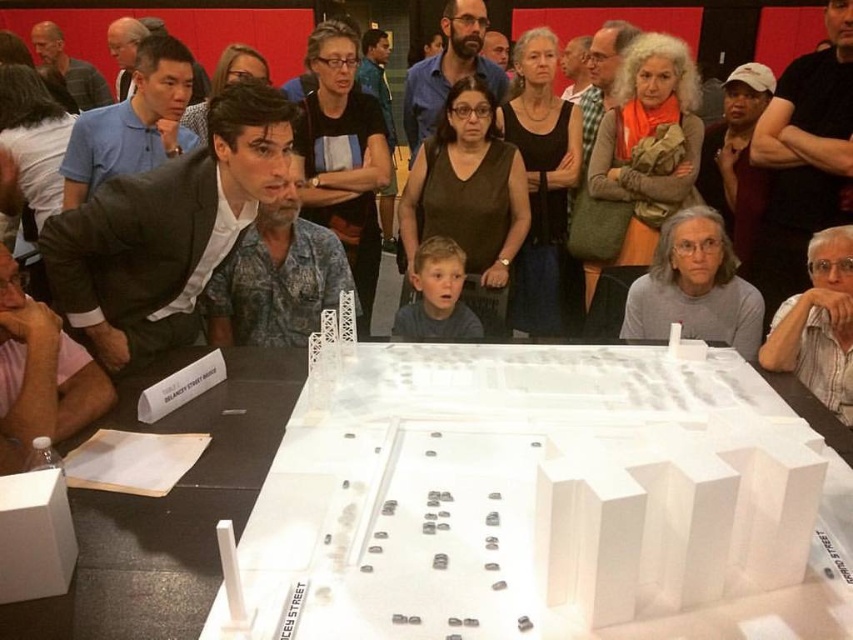
You are an architect standing at the back of the room and want to walk to the white plastic table at center and the matte black suit at center. Which object should you approach first if you want to reach the one closer to you?

The white plastic table at center is to the left of the matte black suit at center, so depending on your position, you might need to adjust. However, since both are at center, their distance from you at the back might be similar. But according to the description, the table is to the left of the suit. If you are facing the front, the table would be on your left side and the suit on the right. To reach the closer one, you need to know which side you are on. The description doesn

You are a parent standing next to the blonde hair boy at center, and you want to place a small toy car on the white plastic table at center. Can you reach the table without moving the boy? Please explain your reasoning.

The distance between the white plastic table at center and the blonde hair boy at center is 33.65 inches. Since 33.65 inches is approximately 2.8 feet, the parent can likely reach the table from the boy without needing to move him, as the distance is within a typical arm reach.

You are standing in front of the white plastic table at center and want to take a photo of it with your phone. Your phone has a minimum focus distance of 1 meter. Can you focus on the table without moving closer?

The white plastic table at center is 1.18 meters away from the camera, which is beyond the phone camera minimum focus distance of 1 meter. Therefore, you can focus on the table without moving closer.